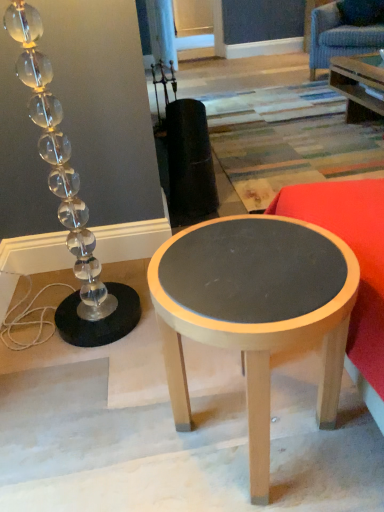
The image size is (384, 512). What do you see at coordinates (255, 311) in the screenshot?
I see `matte gray wood table at center` at bounding box center [255, 311].

The width and height of the screenshot is (384, 512). What do you see at coordinates (339, 37) in the screenshot?
I see `blue fabric swivel chair at upper right` at bounding box center [339, 37].

Locate an element on the screen. This screenshot has width=384, height=512. matte gray wood table at center is located at coordinates (255, 311).

Is matte gray wood table at center positioned in front of blue fabric swivel chair at upper right?

Yes, matte gray wood table at center is in front of blue fabric swivel chair at upper right.

Is point (303, 231) closer or farther from the camera than point (336, 20)?

Point (303, 231) appears to be closer to the viewer than point (336, 20).

How far apart are matte gray wood table at center and blue fabric swivel chair at upper right?

3.82 meters.

Is matte gray wood table at center facing towards blue fabric swivel chair at upper right?

No, matte gray wood table at center is not facing towards blue fabric swivel chair at upper right.

Can you confirm if blue fabric swivel chair at upper right is taller than matte red fabric couch at right?

Correct, blue fabric swivel chair at upper right is much taller as matte red fabric couch at right.

Between blue fabric swivel chair at upper right and matte red fabric couch at right, which one appears on the left side from the viewer's perspective?

matte red fabric couch at right is more to the left.

Which is in front, point (325, 42) or point (381, 236)?

The point (381, 236) is more forward.

From the picture: Are blue fabric swivel chair at upper right and matte red fabric couch at right making contact?

No, blue fabric swivel chair at upper right is not beside matte red fabric couch at right.

From the image's perspective, between matte gray wood table at center and clear glass lamp at left, who is located below?

matte gray wood table at center is shown below in the image.

Which object is closer to the camera, matte gray wood table at center or clear glass lamp at left?

matte gray wood table at center is more forward.

Considering the sizes of objects matte gray wood table at center and clear glass lamp at left in the image provided, who is thinner, matte gray wood table at center or clear glass lamp at left?

Thinner between the two is clear glass lamp at left.

Would you say matte red fabric couch at right is inside or outside matte gray wood table at center?

matte red fabric couch at right cannot be found inside matte gray wood table at center.

Which object is further away from the camera taking this photo, matte red fabric couch at right or matte gray wood table at center?

matte gray wood table at center.

Is matte red fabric couch at right directly adjacent to matte gray wood table at center?

No, matte red fabric couch at right is not beside matte gray wood table at center.

What's the angular difference between matte red fabric couch at right and matte gray wood table at center's facing directions?

The facing directions of matte red fabric couch at right and matte gray wood table at center are 92.1 degrees apart.

Is blue fabric swivel chair at upper right at the right side of matte gray wood table at center?

Yes.

Is blue fabric swivel chair at upper right facing towards matte gray wood table at center?

Yes.

Which object is thinner, blue fabric swivel chair at upper right or matte gray wood table at center?

matte gray wood table at center is thinner.

Considering the relative sizes of blue fabric swivel chair at upper right and matte gray wood table at center in the image provided, is blue fabric swivel chair at upper right bigger than matte gray wood table at center?

Yes, blue fabric swivel chair at upper right is bigger than matte gray wood table at center.

Identify the location of studio couch below the clear glass lamp at left (from a real-world perspective). The width and height of the screenshot is (384, 512). (360, 268).

From a real-world perspective, is clear glass lamp at left located beneath matte red fabric couch at right?

No, from a real-world perspective, clear glass lamp at left is not beneath matte red fabric couch at right.

Is clear glass lamp at left bigger than matte red fabric couch at right?

No, clear glass lamp at left is not bigger than matte red fabric couch at right.

Considering the relative sizes of clear glass lamp at left and matte gray wood table at center in the image provided, is clear glass lamp at left thinner than matte gray wood table at center?

Yes, clear glass lamp at left is thinner than matte gray wood table at center.

Is clear glass lamp at left oriented away from matte gray wood table at center?

No.

Considering the points (66, 181) and (345, 274), which point is in front, point (66, 181) or point (345, 274)?

The point (345, 274) is closer to the camera.

Find the location of `coffee table that appears in front of the blue fabric swivel chair at upper right`. coffee table that appears in front of the blue fabric swivel chair at upper right is located at coordinates (255, 311).

There is a matte red fabric couch at right. Identify the location of swivel chair above it (from a real-world perspective). (339, 37).

Based on their spatial positions, is clear glass lamp at left or matte red fabric couch at right closer to matte gray wood table at center?

matte red fabric couch at right.

When comparing their distances from clear glass lamp at left, does blue fabric swivel chair at upper right or matte red fabric couch at right seem further?

blue fabric swivel chair at upper right.

Based on their spatial positions, is clear glass lamp at left or matte gray wood table at center further from blue fabric swivel chair at upper right?

matte gray wood table at center is positioned further to the anchor blue fabric swivel chair at upper right.

Considering their positions, is matte red fabric couch at right positioned further to blue fabric swivel chair at upper right than clear glass lamp at left?

Among the two, clear glass lamp at left is located further to blue fabric swivel chair at upper right.

Based on their spatial positions, is matte gray wood table at center or clear glass lamp at left further from matte red fabric couch at right?

Based on the image, clear glass lamp at left appears to be further to matte red fabric couch at right.

Estimate the real-world distances between objects in this image. Which object is closer to clear glass lamp at left, matte gray wood table at center or blue fabric swivel chair at upper right?

matte gray wood table at center.

When comparing their distances from clear glass lamp at left, does matte red fabric couch at right or matte gray wood table at center seem closer?

matte gray wood table at center is closer to clear glass lamp at left.

Estimate the real-world distances between objects in this image. Which object is closer to clear glass lamp at left, matte red fabric couch at right or blue fabric swivel chair at upper right?

Based on the image, matte red fabric couch at right appears to be nearer to clear glass lamp at left.

You are a GUI agent. You are given a task and a screenshot of the screen. Output one action in this format:
    pyautogui.click(x=<x>, y=<y>)
    Task: Click on the coffee table between clear glass lamp at left and matte red fabric couch at right from left to right
    The width and height of the screenshot is (384, 512).
    Given the screenshot: What is the action you would take?
    255,311

This screenshot has width=384, height=512. What are the coordinates of `lamp between matte gray wood table at center and blue fabric swivel chair at upper right from front to back` in the screenshot? It's located at coord(69,200).

At what (x,y) coordinates should I click in order to perform the action: click on coffee table between matte red fabric couch at right and blue fabric swivel chair at upper right in the front-back direction. Please return your answer as a coordinate pair (x, y). The width and height of the screenshot is (384, 512). Looking at the image, I should click on click(255, 311).

Where is `lamp located between matte red fabric couch at right and blue fabric swivel chair at upper right in the depth direction`? The image size is (384, 512). lamp located between matte red fabric couch at right and blue fabric swivel chair at upper right in the depth direction is located at coordinates (69, 200).